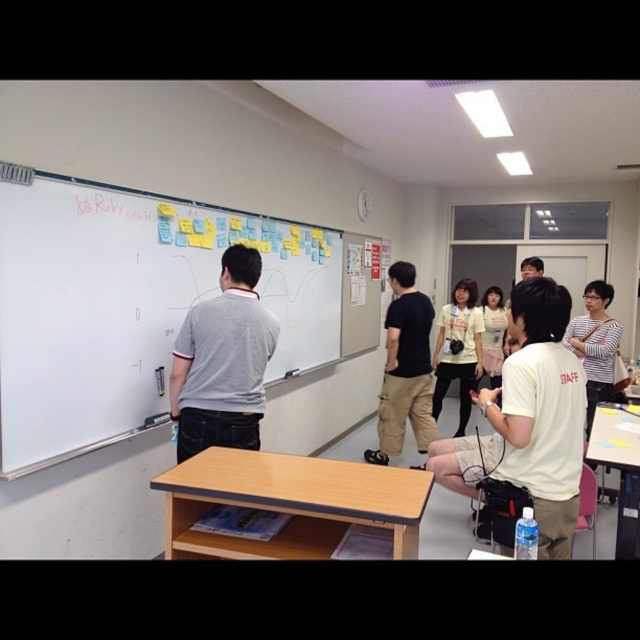
Question: Which point is farther to the camera?

Choices:
 (A) (227, 424)
 (B) (371, 456)
 (C) (515, 364)

Answer: (B)

Question: Is white matte whiteboard at upper left in front of black cotton shirt at center?

Choices:
 (A) no
 (B) yes

Answer: (B)

Question: Which of the following is the farthest from the observer?

Choices:
 (A) white matte whiteboard at upper left
 (B) black cotton shirt at center
 (C) yellow matte shirt at center
 (D) white cotton shirt at center

Answer: (C)

Question: Does gray cotton shirt at center come behind black cotton shirt at center?

Choices:
 (A) yes
 (B) no

Answer: (B)

Question: Does gray cotton shirt at center appear over yellow matte shirt at center?

Choices:
 (A) yes
 (B) no

Answer: (A)

Question: Estimate the real-world distances between objects in this image. Which object is closer to the yellow matte shirt at center?

Choices:
 (A) black cotton shirt at center
 (B) white matte whiteboard at upper left
 (C) gray cotton shirt at center
 (D) white cotton shirt at center

Answer: (A)